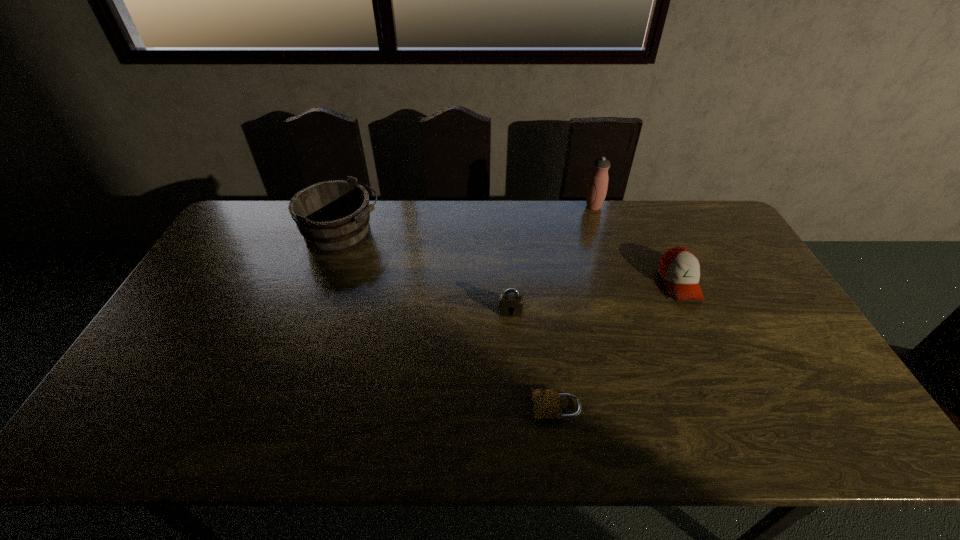
Where is `vacant space positioned on the front of the second tallest object`? The height and width of the screenshot is (540, 960). vacant space positioned on the front of the second tallest object is located at coordinates 304,340.

Locate an element on the screen. vacant space located on the front-facing side of the baseball cap is located at coordinates (709, 348).

This screenshot has height=540, width=960. What are the coordinates of `vacant region located at the front of the taller padlock near the keyhole` in the screenshot? It's located at (517, 414).

Where is `vacant point located on the keyhole side of the third object from right to left`? vacant point located on the keyhole side of the third object from right to left is located at coordinates (441, 408).

Where is `free location located on the keyhole side of the third object from right to left`? The height and width of the screenshot is (540, 960). free location located on the keyhole side of the third object from right to left is located at coordinates (483, 408).

Where is `vacant space located on the keyhole side of the third object from right to left`? vacant space located on the keyhole side of the third object from right to left is located at coordinates (441, 408).

The image size is (960, 540). What are the coordinates of `thermos bottle present at the far edge` in the screenshot? It's located at (597, 187).

Where is `wine bucket situated at the far edge`? The height and width of the screenshot is (540, 960). wine bucket situated at the far edge is located at coordinates (333, 216).

Identify the location of object located in the near edge section of the desktop. The width and height of the screenshot is (960, 540). (546, 402).

The image size is (960, 540). I want to click on free region at the far edge of the desktop, so click(x=537, y=233).